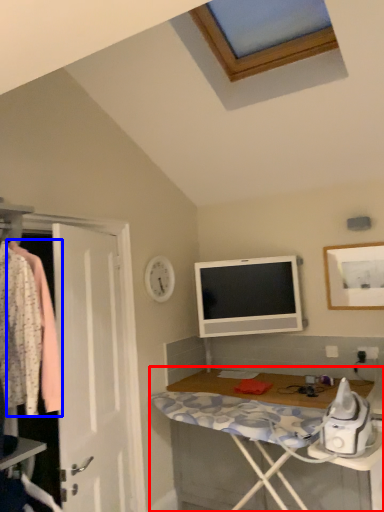
Question: Which of the following is the closest to the observer, desk (highlighted by a red box) or clothing (highlighted by a blue box)?

Choices:
 (A) desk
 (B) clothing

Answer: (B)